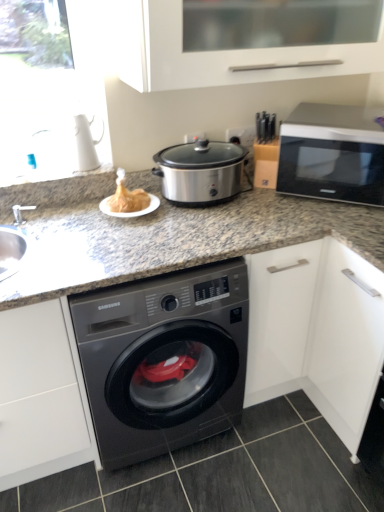
This screenshot has height=512, width=384. I want to click on white matte cabinet at upper center, so click(219, 53).

The width and height of the screenshot is (384, 512). What do you see at coordinates (164, 234) in the screenshot?
I see `granite gray countertop at center` at bounding box center [164, 234].

At what (x,y) coordinates should I click in order to perform the action: click on stainless steel slow cooker at center. Please return your answer as a coordinate pair (x, y). This screenshot has width=384, height=512. Looking at the image, I should click on (200, 170).

Measure the distance between point [185,293] and camera.

Point [185,293] is 1.40 meters away from camera.

Based on the photo, measure the distance between point (x=284, y=170) and camera.

Point (x=284, y=170) and camera are 1.71 meters apart from each other.

This screenshot has height=512, width=384. I want to click on white matte cabinet at upper center, so click(x=219, y=53).

Based on the photo, is stainless steel slow cooker at center in front of dark gray tile at lower center?

No, it is behind dark gray tile at lower center.

Considering the sizes of objects stainless steel slow cooker at center and dark gray tile at lower center in the image provided, who is bigger, stainless steel slow cooker at center or dark gray tile at lower center?

dark gray tile at lower center.

How many degrees apart are the facing directions of stainless steel slow cooker at center and dark gray tile at lower center?

0.708 degrees separate the facing orientations of stainless steel slow cooker at center and dark gray tile at lower center.

How much distance is there between stainless steel slow cooker at center and dark gray tile at lower center?

A distance of 3.61 feet exists between stainless steel slow cooker at center and dark gray tile at lower center.

Considering their positions, is golden crispy turkey at center located in front of or behind silver metallic microwave at upper right?

Clearly, golden crispy turkey at center is behind silver metallic microwave at upper right.

Is golden crispy turkey at center outside of silver metallic microwave at upper right?

Yes, golden crispy turkey at center is not within silver metallic microwave at upper right.

Consider the image. Can you confirm if golden crispy turkey at center is bigger than silver metallic microwave at upper right?

No.

This screenshot has height=512, width=384. In the image, there is a golden crispy turkey at center. What are the coordinates of `microwave oven above it (from the image's perspective)` in the screenshot? It's located at (333, 153).

In order to click on countertop lying on the left of stainless steel slow cooker at center in this screenshot , I will do `click(164, 234)`.

Would you say granite gray countertop at center contains stainless steel slow cooker at center?

No, granite gray countertop at center does not contain stainless steel slow cooker at center.

How much distance is there between granite gray countertop at center and stainless steel slow cooker at center?

granite gray countertop at center is 9.37 inches from stainless steel slow cooker at center.

How much distance is there between dark gray tile at lower center and stainless steel slow cooker at center?

dark gray tile at lower center and stainless steel slow cooker at center are 3.61 feet apart from each other.

Is dark gray tile at lower center oriented towards stainless steel slow cooker at center?

No, dark gray tile at lower center is not turned towards stainless steel slow cooker at center.

Is dark gray tile at lower center taller than stainless steel slow cooker at center?

Incorrect, the height of dark gray tile at lower center is not larger of that of stainless steel slow cooker at center.

Does dark gray tile at lower center have a lesser width compared to stainless steel slow cooker at center?

No.

Is granite gray countertop at center surrounded by white matte cabinet at upper center?

No, white matte cabinet at upper center does not contain granite gray countertop at center.

Is point (204, 79) in front of point (311, 222)?

Yes.

Does white matte cabinet at upper center have a smaller size compared to granite gray countertop at center?

No, white matte cabinet at upper center is not smaller than granite gray countertop at center.

Is white matte cabinet at upper center oriented towards granite gray countertop at center?

No, white matte cabinet at upper center is not turned towards granite gray countertop at center.

Is point (120, 170) farther from viewer compared to point (265, 508)?

Yes, it is.

In the scene shown: Is golden crispy turkey at center bigger than dark gray tile at lower center?

Actually, golden crispy turkey at center might be smaller than dark gray tile at lower center.

Is golden crispy turkey at center shorter than dark gray tile at lower center?

Incorrect, the height of golden crispy turkey at center does not fall short of that of dark gray tile at lower center.

Is golden crispy turkey at center thinner than dark gray tile at lower center?

Yes, golden crispy turkey at center is thinner than dark gray tile at lower center.

Can you tell me how much dark gray tile at lower center and silver metallic microwave at upper right differ in facing direction?

42.2 degrees.

Is dark gray tile at lower center oriented towards silver metallic microwave at upper right?

No.

Does dark gray tile at lower center have a lesser width compared to silver metallic microwave at upper right?

Incorrect, the width of dark gray tile at lower center is not less than that of silver metallic microwave at upper right.

Between dark gray tile at lower center and silver metallic microwave at upper right, which one appears on the left side from the viewer's perspective?

dark gray tile at lower center.

What are the coordinates of `slow cooker behind the dark gray tile at lower center` in the screenshot? It's located at (200, 170).

I want to click on food below the silver metallic microwave at upper right (from a real-world perspective), so [x=127, y=197].

When comparing their distances from golden crispy turkey at center, does dark gray tile at lower center or stainless steel slow cooker at center seem closer?

The object closer to golden crispy turkey at center is stainless steel slow cooker at center.

Which object lies nearer to the anchor point white matte cabinet at upper center, stainless steel slow cooker at center or black glossy washing machine at center?

Among the two, stainless steel slow cooker at center is located nearer to white matte cabinet at upper center.

From the picture: Estimate the real-world distances between objects in this image. Which object is further from silver metallic microwave at upper right, black glossy washing machine at center or granite gray countertop at center?

black glossy washing machine at center is positioned further to the anchor silver metallic microwave at upper right.

Which object lies further to the anchor point black glossy washing machine at center, golden crispy turkey at center or white matte cabinet at upper center?

The object further to black glossy washing machine at center is white matte cabinet at upper center.

Based on their spatial positions, is white matte cabinet at upper center or black glossy washing machine at center further from silver metallic microwave at upper right?

The object further to silver metallic microwave at upper right is black glossy washing machine at center.

Estimate the real-world distances between objects in this image. Which object is further from golden crispy turkey at center, granite gray countertop at center or dark gray tile at lower center?

Based on the image, dark gray tile at lower center appears to be further to golden crispy turkey at center.

Which object lies nearer to the anchor point black glossy washing machine at center, granite gray countertop at center or silver metallic microwave at upper right?

granite gray countertop at center is closer to black glossy washing machine at center.

Based on their spatial positions, is golden crispy turkey at center or dark gray tile at lower center closer to silver metallic microwave at upper right?

The object closer to silver metallic microwave at upper right is golden crispy turkey at center.

Where is `countertop between golden crispy turkey at center and dark gray tile at lower center from top to bottom`? The width and height of the screenshot is (384, 512). countertop between golden crispy turkey at center and dark gray tile at lower center from top to bottom is located at coordinates (164, 234).

Where is `food between white matte cabinet at upper center and granite gray countertop at center in the up-down direction`? This screenshot has width=384, height=512. food between white matte cabinet at upper center and granite gray countertop at center in the up-down direction is located at coordinates [x=127, y=197].

Locate an element on the screen. This screenshot has height=512, width=384. cabinetry located between granite gray countertop at center and silver metallic microwave at upper right in the left-right direction is located at coordinates (219, 53).

Image resolution: width=384 pixels, height=512 pixels. In order to click on washing machine between granite gray countertop at center and silver metallic microwave at upper right from left to right in this screenshot , I will do `click(164, 360)`.